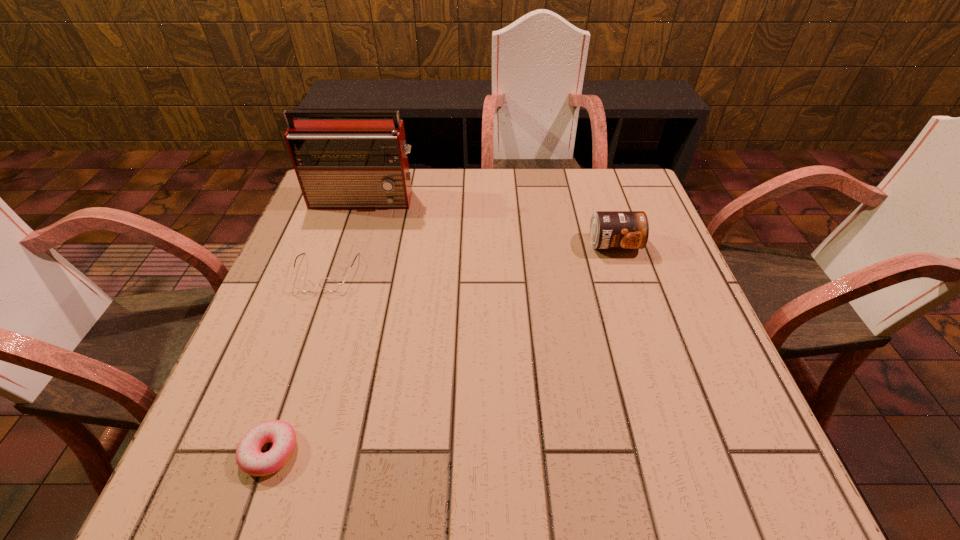
This screenshot has width=960, height=540. I want to click on radio receiver, so pyautogui.click(x=340, y=163).

You are a GUI agent. You are given a task and a screenshot of the screen. Output one action in this format:
    pyautogui.click(x=<x>, y=<y>)
    Task: Click on the tallest object
    
    Given the screenshot: What is the action you would take?
    pyautogui.click(x=340, y=163)

This screenshot has height=540, width=960. Identify the location of the rightmost object. (608, 229).

Identify the location of can. (608, 229).

I want to click on the second shortest object, so click(x=302, y=284).

Where is `the shortest object`? the shortest object is located at coordinates (250, 459).

At what (x,y) coordinates should I click in order to perform the action: click on the nearest object. Please return your answer as a coordinate pair (x, y). This screenshot has height=540, width=960. Looking at the image, I should click on (250, 459).

Where is `free space located on the front-facing side of the radio receiver`? The image size is (960, 540). free space located on the front-facing side of the radio receiver is located at coordinates (345, 261).

I want to click on vacant space located 0.130m on the front label of the third shortest object, so click(x=632, y=296).

Where is `free space located through the lenses of the spectacles`? This screenshot has height=540, width=960. free space located through the lenses of the spectacles is located at coordinates (276, 414).